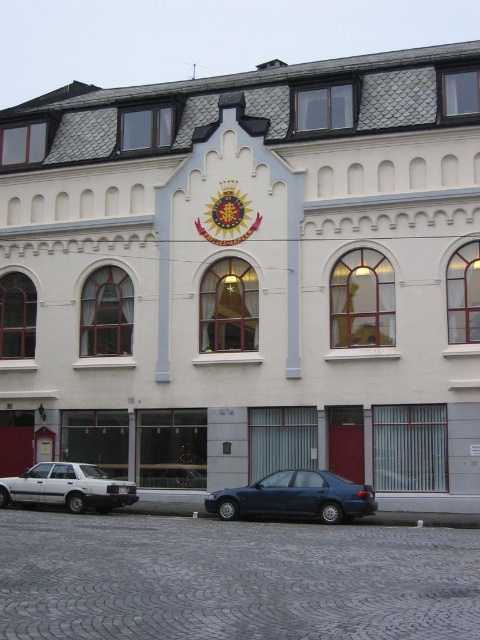
You are standing in front of the two story building and see the dark blue sedan at center and the white matte sedan at lower left. Which car is closer to you?

The dark blue sedan at center is closer to the viewer than the white matte sedan at lower left.